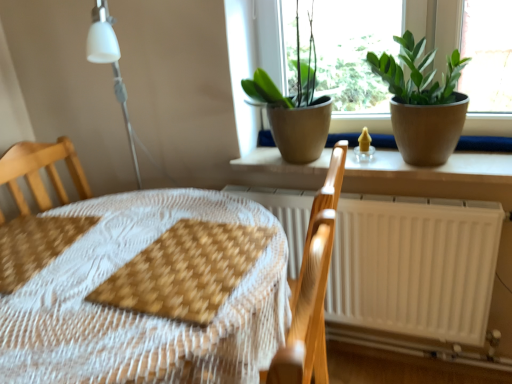
At what (x,y) coordinates should I click in order to perform the action: click on free spot in front of brown woven placemat at center, arranged as the 2th sheet when viewed from the left. Please return your answer as a coordinate pair (x, y). Image resolution: width=512 pixels, height=384 pixels. Looking at the image, I should click on (141, 339).